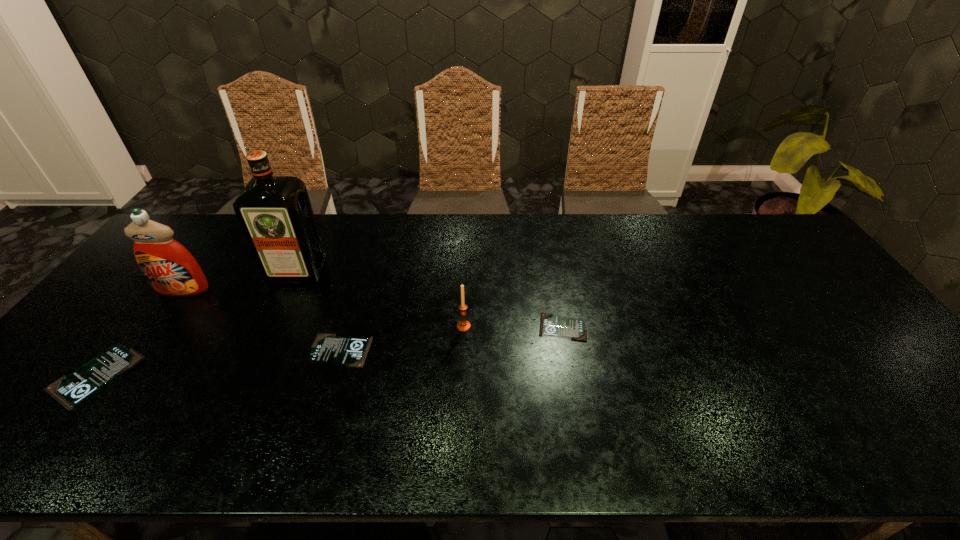
Given the evenly spaced identity cards in the image, where should an extra identity card be added on the right to preserve the spacing? Please point to a vacant space. Please provide its 2D coordinates. Your answer should be formatted as a tuple, i.e. [(x, y)], where the tuple contains the x and y coordinates of a point satisfying the conditions above.

[(762, 306)]